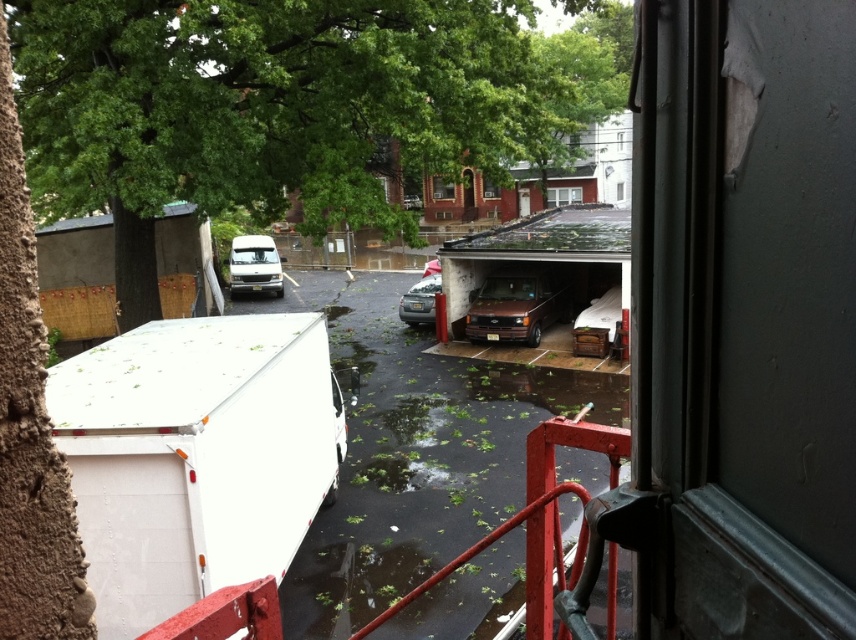
Who is lower down, brown matte van at center or white matte van at center?

Positioned lower is brown matte van at center.

Where is `brown matte van at center`? brown matte van at center is located at coordinates (516, 305).

Does green leafy tree at upper left appear under white matte van at center?

Incorrect, green leafy tree at upper left is not positioned below white matte van at center.

Where is `green leafy tree at upper left`? Image resolution: width=856 pixels, height=640 pixels. green leafy tree at upper left is located at coordinates (282, 106).

Can you confirm if green leafy tree at upper left is shorter than green leafy water at center?

In fact, green leafy tree at upper left may be taller than green leafy water at center.

Does point (539, 120) come farther from viewer compared to point (330, 340)?

No, (539, 120) is in front of (330, 340).

Identify the location of green leafy tree at upper left. The width and height of the screenshot is (856, 640). (282, 106).